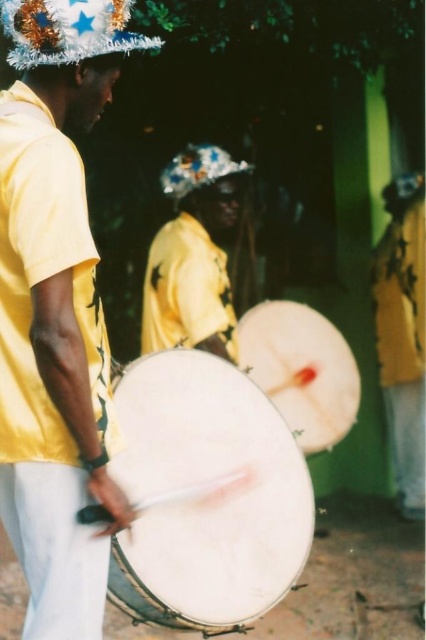
Question: Which object appears closest to the camera in this image?

Choices:
 (A) shiny metallic hat at upper left
 (B) yellow matte shirt at right
 (C) white drum at center
 (D) yellow matte shirt at left

Answer: (D)

Question: Does shiny metallic hat at upper left appear over glittery metallic hat at center?

Choices:
 (A) no
 (B) yes

Answer: (A)

Question: Is shiny metallic hat at upper left below glittery metallic hat at center?

Choices:
 (A) no
 (B) yes

Answer: (B)

Question: Is yellow matte shirt at left in front of white matte drum at center?

Choices:
 (A) no
 (B) yes

Answer: (B)

Question: Which of the following is the closest to the observer?

Choices:
 (A) (14, 33)
 (B) (204, 144)
 (C) (313, 388)
 (D) (158, 294)

Answer: (A)

Question: Which point appears farthest from the camera in this image?

Choices:
 (A) (301, 364)
 (B) (204, 164)
 (C) (190, 304)
 (D) (267, 472)

Answer: (B)